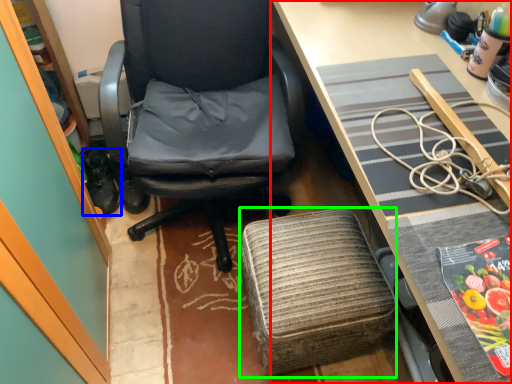
Question: Which object is positioned closest to desk (highlighted by a red box)? Select from footwear (highlighted by a blue box) and stool (highlighted by a green box).

Choices:
 (A) footwear
 (B) stool

Answer: (B)